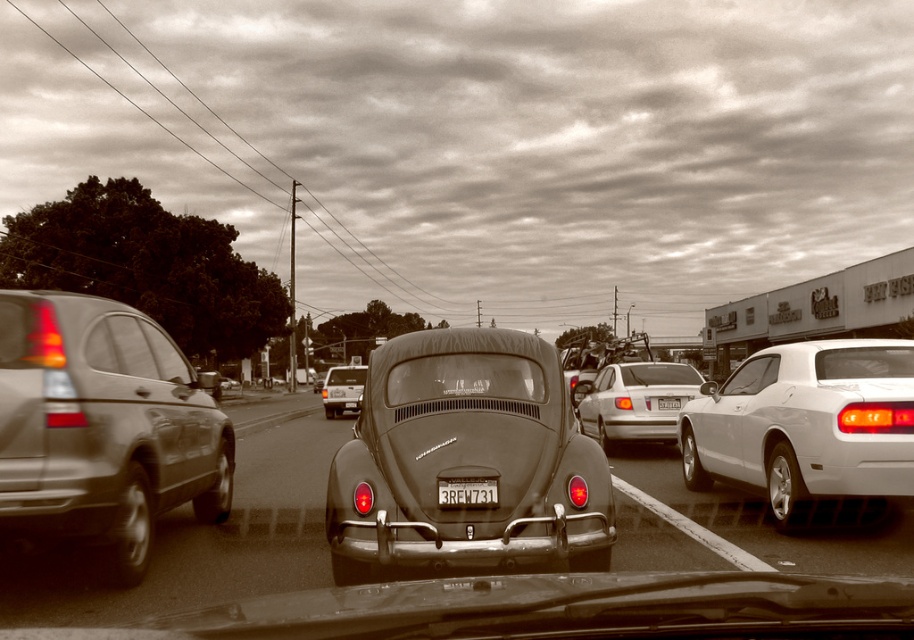
You are standing at the center of the street and see two points marked in the image. Which point, point [408,436] or point [660,401], is closer to you?

Point [408,436] is closer to the camera than point [660,401].

You are a pedestrian standing on the sidewalk and see the matte black car at center and the metallic silver van at center. Which vehicle is blocking the view of the other?

The matte black car at center is positioned over the metallic silver van at center, so it is blocking the view of the metallic silver van at center.